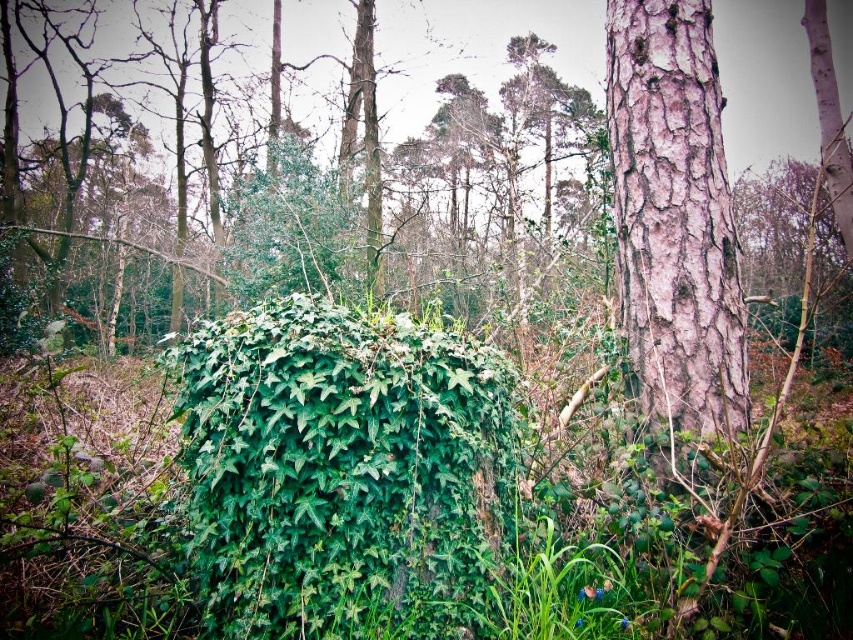
You are a hiker trying to navigate through the woodland scene. You need to pass between the green leafy bush at center and the smooth pink bark at right. Based on their widths, which object will you have to maneuver around more carefully?

The green leafy bush at center is wider than the smooth pink bark at right, so you will need to maneuver around it more carefully due to its greater width.

You are standing in the woodland scene and want to place a small flag at the point marked by the coordinates point [343,472]. Based on the scene description, where exactly would this flag be placed?

The point [343,472] is on the green leafy bush at center, so the flag would be placed on the green leafy bush at center.